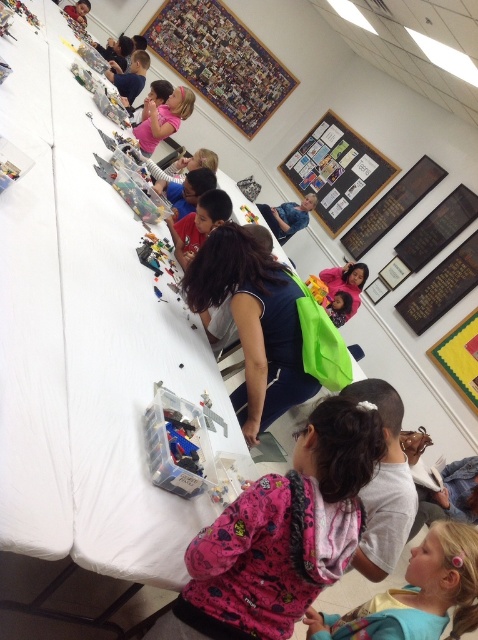
Is point (201, 269) farther from camera compared to point (315, 200)?

No, (201, 269) is closer to viewer.

Who is positioned more to the right, dark blue fabric at center or blue denim jeans at center?

blue denim jeans at center

Is point (230, 232) behind point (289, 211)?

No, (230, 232) is in front of (289, 211).

Where is `dark blue fabric at center`? This screenshot has height=640, width=478. dark blue fabric at center is located at coordinates (253, 323).

Where is `pink fabric at lower right`? This screenshot has height=640, width=478. pink fabric at lower right is located at coordinates (x=416, y=593).

Which of these two, pink fabric at lower right or pink fabric shirt at upper center, stands taller?

Standing taller between the two is pink fabric shirt at upper center.

Is point (452, 573) behind point (191, 108)?

No, it is not.

Identify the location of pink fabric at lower right. (416, 593).

Can you confirm if dark blue fabric at center is smaller than pink fabric at lower right?

No, dark blue fabric at center is not smaller than pink fabric at lower right.

Can you confirm if dark blue fabric at center is positioned to the right of pink fabric at lower right?

No, dark blue fabric at center is not to the right of pink fabric at lower right.

This screenshot has width=478, height=640. Identify the location of dark blue fabric at center. (253, 323).